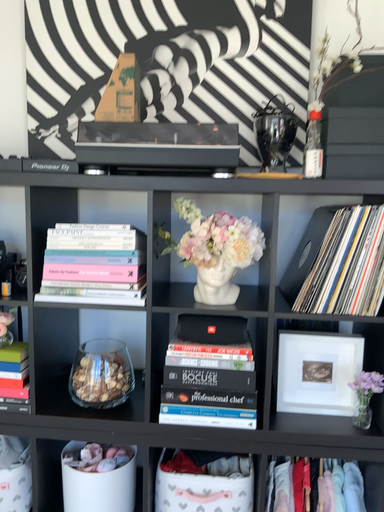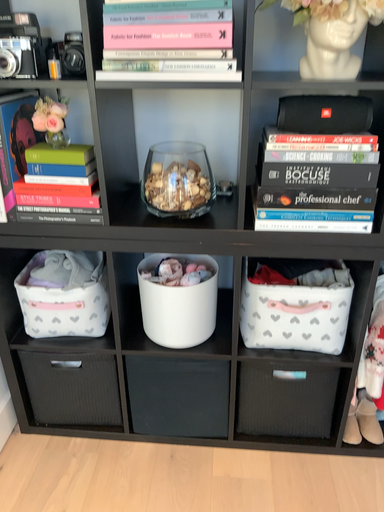
Question: How did the camera likely rotate when shooting the video?

Choices:
 (A) rotated downward
 (B) rotated upward

Answer: (A)